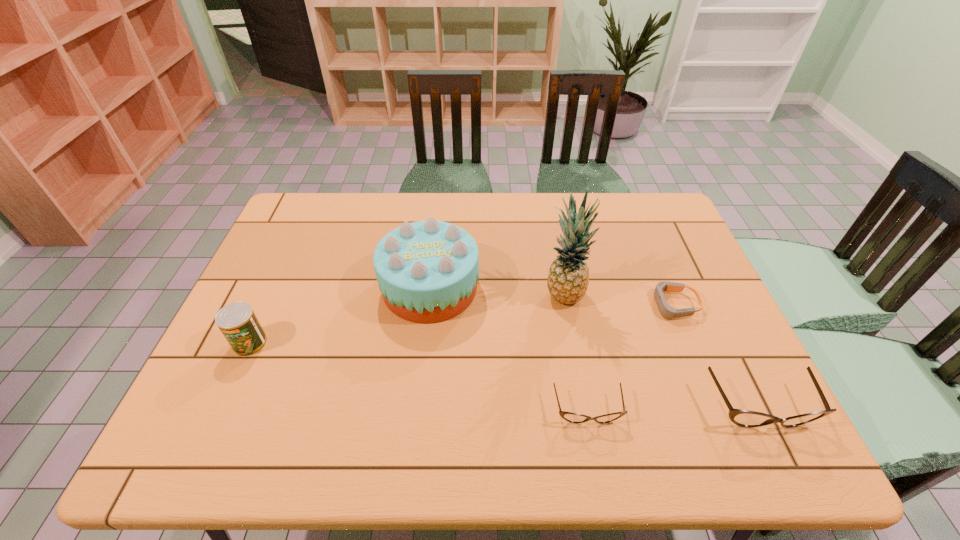
Where is `free space between the shorter spectacles and the pineapple`? The height and width of the screenshot is (540, 960). free space between the shorter spectacles and the pineapple is located at coordinates (575, 352).

At what (x,y) coordinates should I click in order to perform the action: click on blank region between the cake and the fifth tallest object. Please return your answer as a coordinate pair (x, y). The image size is (960, 540). Looking at the image, I should click on (509, 349).

You are a GUI agent. You are given a task and a screenshot of the screen. Output one action in this format:
    pyautogui.click(x=<x>, y=<y>)
    Task: Click on the free space between the third shortest object and the leftmost object
    The width and height of the screenshot is (960, 540).
    Given the screenshot: What is the action you would take?
    pyautogui.click(x=504, y=375)

Locate an element on the screen. Image resolution: width=960 pixels, height=540 pixels. free area in between the second shortest object and the pineapple is located at coordinates (575, 352).

Identify the location of the closest object to the can. This screenshot has height=540, width=960. (427, 271).

Choose which object is the third nearest neighbor to the fourth tallest object. Please provide its 2D coordinates. Your answer should be formatted as a tuple, i.e. [(x, y)], where the tuple contains the x and y coordinates of a point satisfying the conditions above.

[(568, 278)]

Where is `blank area in the image that satisfies the following two spatial constraints: 1. on the back side of the tallest object; 2. on the left side of the fourth farthest object`? The width and height of the screenshot is (960, 540). blank area in the image that satisfies the following two spatial constraints: 1. on the back side of the tallest object; 2. on the left side of the fourth farthest object is located at coordinates (273, 294).

Where is `free region that satisfies the following two spatial constraints: 1. on the back side of the fourth shortest object; 2. on the left side of the second object from left to right`? Image resolution: width=960 pixels, height=540 pixels. free region that satisfies the following two spatial constraints: 1. on the back side of the fourth shortest object; 2. on the left side of the second object from left to right is located at coordinates (276, 288).